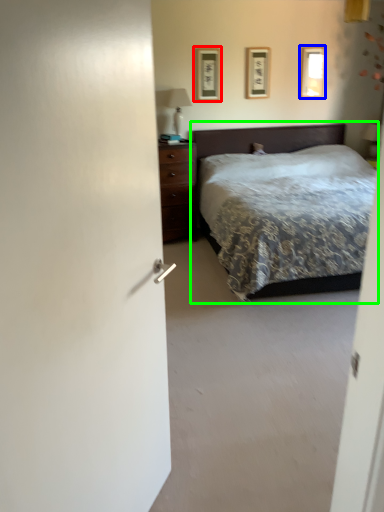
Question: Estimate the real-world distances between objects in this image. Which object is farther from picture frame (highlighted by a red box), picture frame (highlighted by a blue box) or bed (highlighted by a green box)?

Choices:
 (A) picture frame
 (B) bed

Answer: (A)